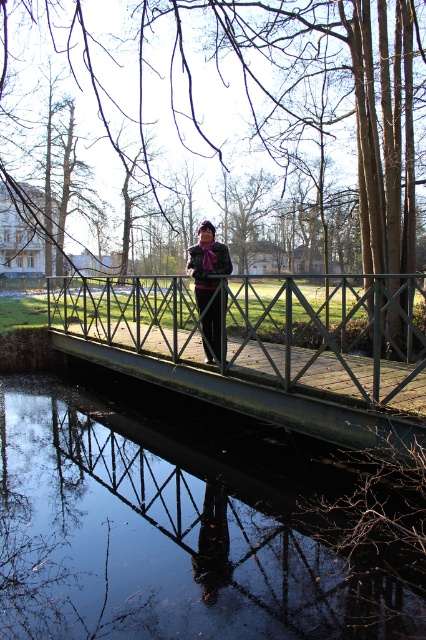
Describe the element at coordinates (169, 528) in the screenshot. I see `glossy water at bridge center` at that location.

Between point (259, 557) and point (215, 259), which one is positioned in front?

Point (259, 557) is more forward.

You are a GUI agent. You are given a task and a screenshot of the screen. Output one action in this format:
    pyautogui.click(x=<x>, y=<y>)
    Task: Click on the glossy water at bridge center
    
    Given the screenshot: What is the action you would take?
    pyautogui.click(x=169, y=528)

Does green metal pedestrian bridge at center appear over plaid wool coat at center?

Correct, green metal pedestrian bridge at center is located above plaid wool coat at center.

Image resolution: width=426 pixels, height=640 pixels. What do you see at coordinates (262, 346) in the screenshot?
I see `green metal pedestrian bridge at center` at bounding box center [262, 346].

Identify the location of green metal pedestrian bridge at center. Image resolution: width=426 pixels, height=640 pixels. (262, 346).

Who is lower down, glossy water at bridge center or green metal pedestrian bridge at center?

Positioned lower is glossy water at bridge center.

This screenshot has width=426, height=640. What do you see at coordinates (169, 528) in the screenshot?
I see `glossy water at bridge center` at bounding box center [169, 528].

Is point (161, 468) less distant than point (333, 381)?

No, (161, 468) is behind (333, 381).

In order to click on glossy water at bridge center in this screenshot , I will do `click(169, 528)`.